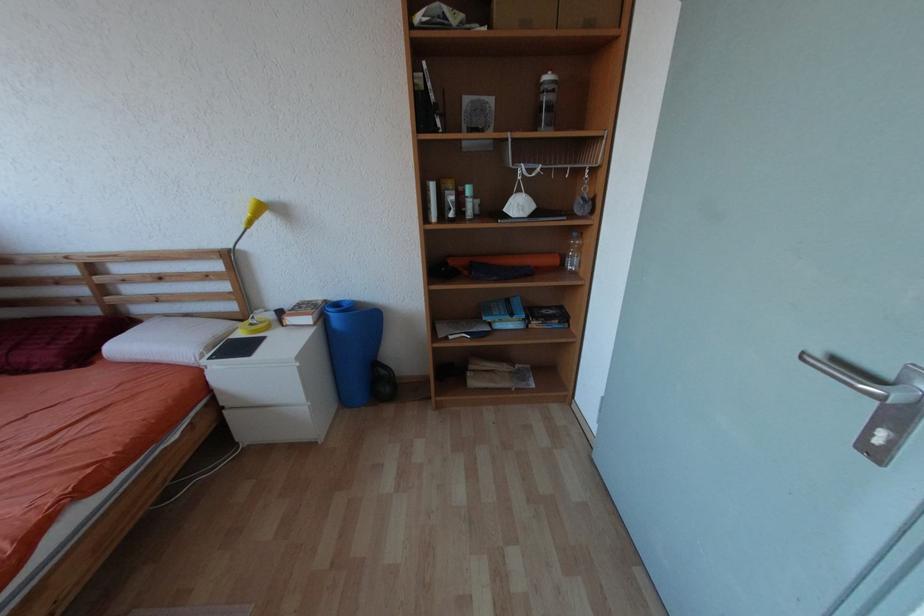
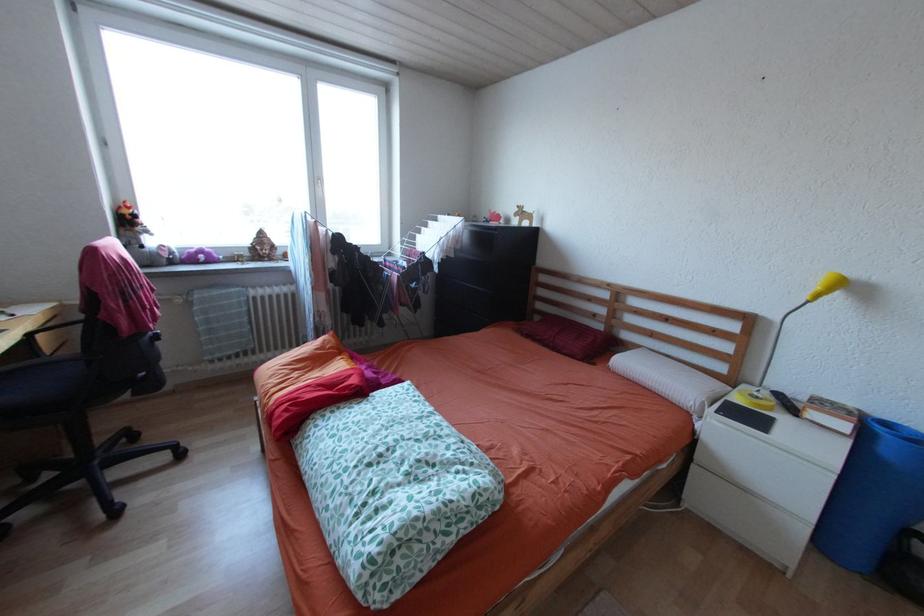
Question: The images are taken continuously from a first-person perspective. In which direction is your viewpoint rotating?

Choices:
 (A) Left
 (B) Right
 (C) Up
 (D) Down

Answer: (A)